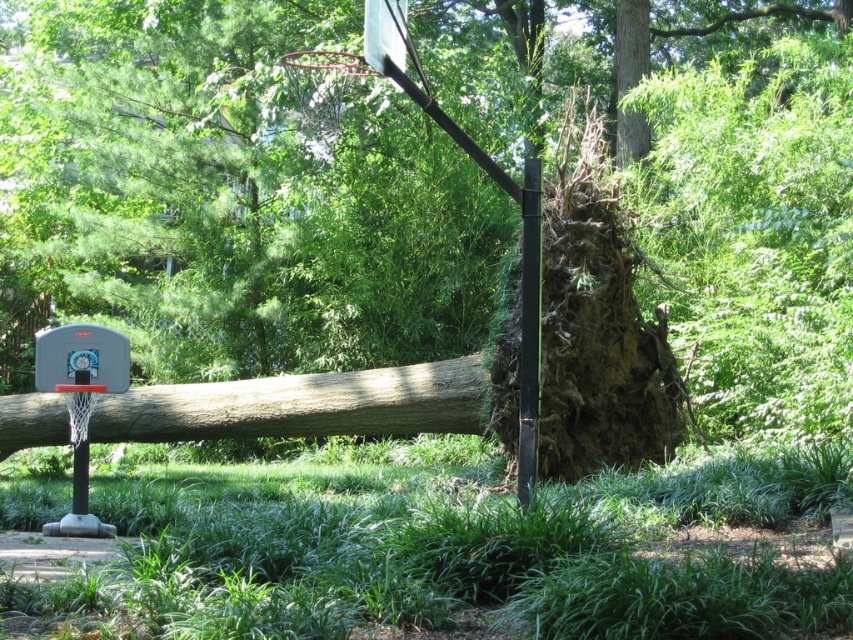
You are a park maintenance worker assessing damage after a storm. You see the brown rough tree trunk at center and the matte gray basketball hoop at left. Which object requires immediate attention based on their relative sizes?

The brown rough tree trunk at center requires immediate attention because it is larger in size than the matte gray basketball hoop at left, making it more hazardous and needing urgent removal.

You are standing in the backyard and see the basketball hoop with a red rim and white backboard. There is a point marked at coordinates [302,404]. What object is located at that point?

The point at coordinates [302,404] marks the brown rough tree trunk at center.